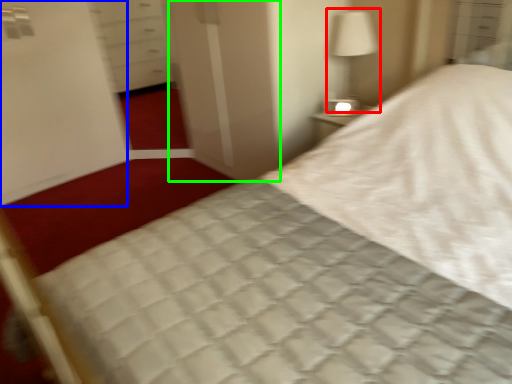
Question: Considering the real-world distances, which object is closest to bedside lamp (highlighted by a red box)? screen door (highlighted by a blue box) or screen door (highlighted by a green box).

Choices:
 (A) screen door
 (B) screen door

Answer: (B)